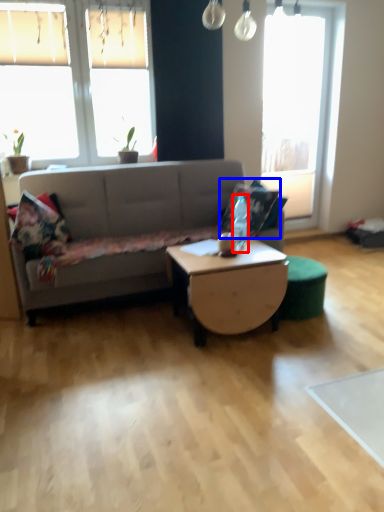
Question: Which of the following is the farthest to the observer, bottle (highlighted by a red box) or pillow (highlighted by a blue box)?

Choices:
 (A) bottle
 (B) pillow

Answer: (B)